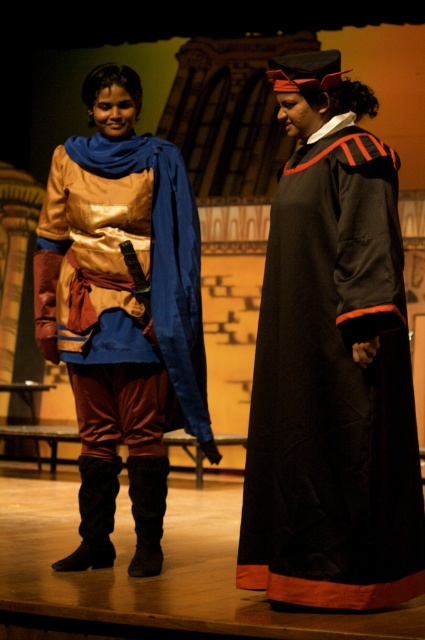
Question: Can you confirm if black velvet gown at right is positioned below shiny gold tunic at center?

Choices:
 (A) yes
 (B) no

Answer: (A)

Question: Which of the following is the farthest from the observer?

Choices:
 (A) (363, 369)
 (B) (76, 266)

Answer: (B)

Question: Which point is closer to the camera?

Choices:
 (A) (291, 490)
 (B) (153, 266)

Answer: (A)

Question: Does black velvet gown at right appear on the right side of shiny gold tunic at center?

Choices:
 (A) no
 (B) yes

Answer: (B)

Question: Among these objects, which one is farthest from the camera?

Choices:
 (A) shiny gold tunic at center
 (B) black velvet gown at right

Answer: (A)

Question: Is black velvet gown at right smaller than shiny gold tunic at center?

Choices:
 (A) no
 (B) yes

Answer: (B)